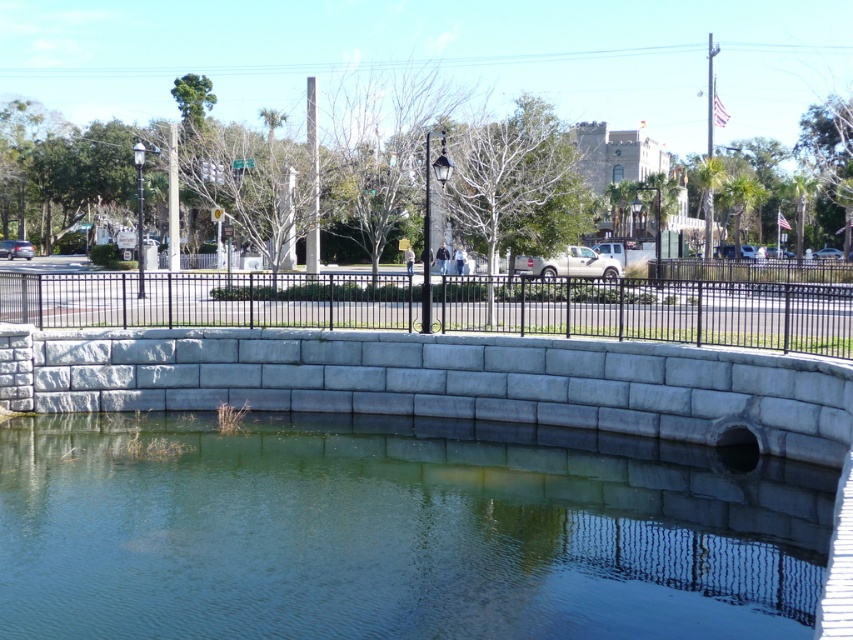
Question: Is the position of gray concrete pool at center less distant than that of black metal fence at center?

Choices:
 (A) no
 (B) yes

Answer: (B)

Question: Which of the following is the farthest from the observer?

Choices:
 (A) gray concrete pool at center
 (B) black metal fence at center

Answer: (B)

Question: Is gray concrete pool at center positioned in front of black metal fence at center?

Choices:
 (A) yes
 (B) no

Answer: (A)

Question: Can you confirm if gray concrete pool at center is bigger than black metal fence at center?

Choices:
 (A) yes
 (B) no

Answer: (B)